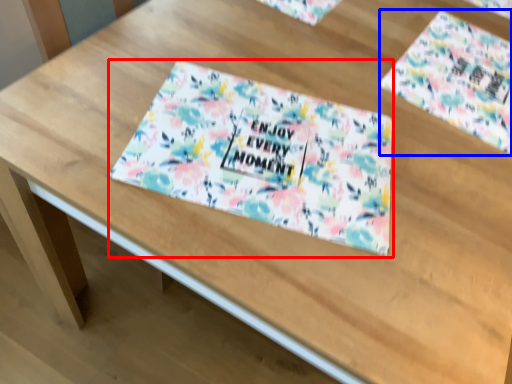
Question: Which of the following is the farthest to the observer, tablecloth (highlighted by a red box) or flyer (highlighted by a blue box)?

Choices:
 (A) tablecloth
 (B) flyer

Answer: (B)